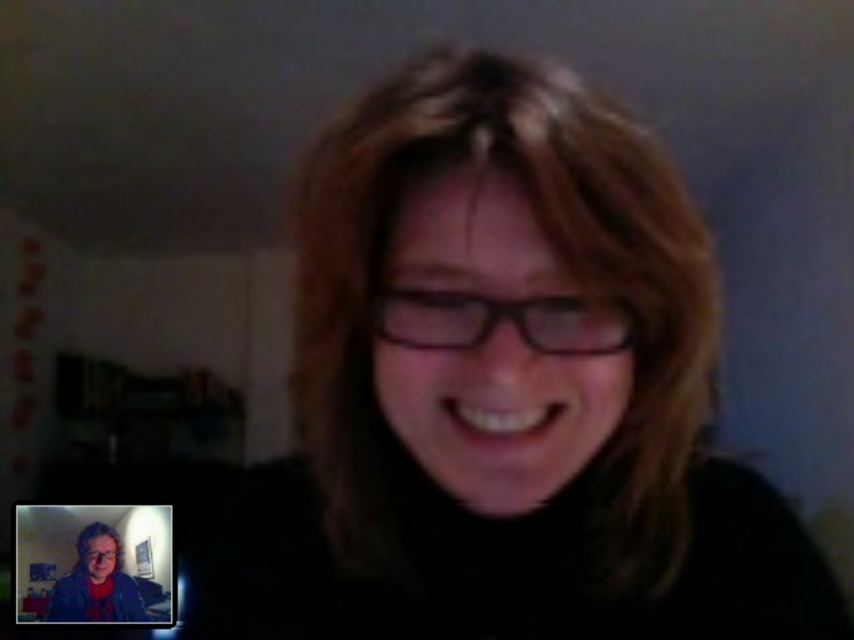
You are trying to determine the spatial relationship between the matte black glasses at center and the matte black hair at center in the image. Which object is located above the other?

The matte black glasses at center is positioned over matte black hair at center, so the matte black glasses at center is above the matte black hair at center.

You are using a video conferencing tool and need to adjust your camera to focus on the matte black glasses at center. The tool requires you to input coordinates between 0 and 1 for the center point. What are the coordinates you should enter?

The coordinates for the matte black glasses at center are at point (502, 388). Therefore, you should enter 0.609 and 0.590 as the X and Y coordinates respectively to focus on the matte black glasses at center.

You are designing a digital frame for a video call background. You need to ensure that the matte black glasses at center and the matte black hair at center are clearly visible. Based on their sizes, which one might require more contrast adjustment to stand out?

The matte black glasses at center is thinner than the matte black hair at center, so it might require more contrast adjustment to stand out.